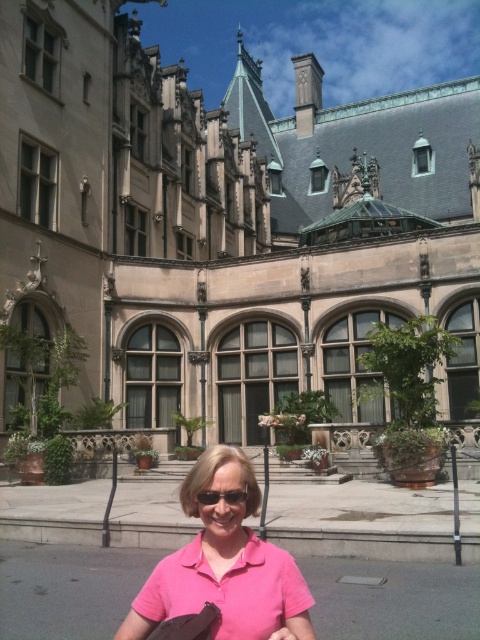
You are a photographer wanting to capture the pink fabric at center and sunglasses at center in a single shot. Which object should you focus on first if you want to ensure both are in focus?

The pink fabric at center has a greater height compared to sunglasses at center, so you should focus on the pink fabric at center first to ensure both are in focus.

You are a photographer trying to capture the historic mansion with both the pink fabric at center and the pink fabric at lower center in the frame. Which pink fabric should you focus on to ensure it appears wider in the photo?

The pink fabric at center should be focused on because its width is larger than the pink fabric at lower center, making it more prominent in the photo.